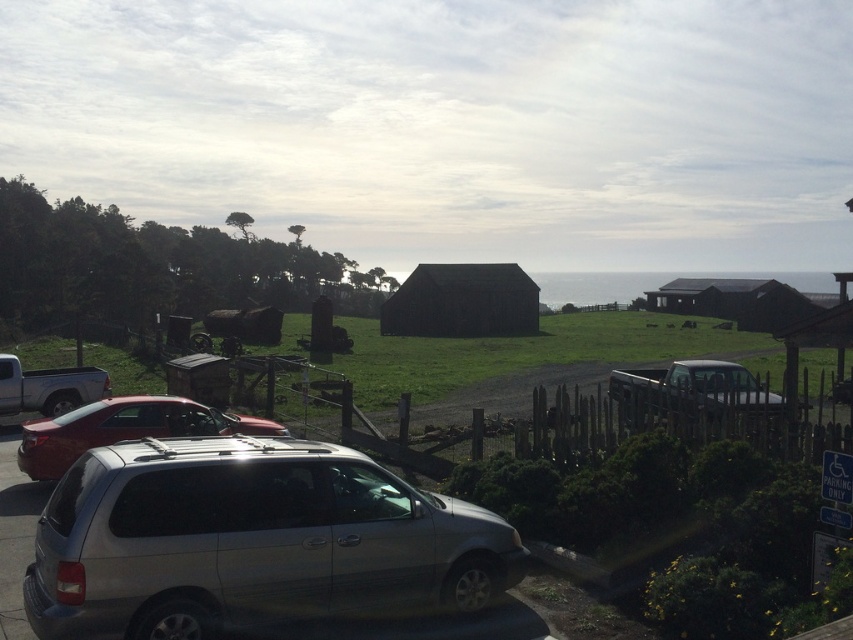
Does metallic silver truck at right appear on the left side of dark brown wooden hut at right?

Indeed, metallic silver truck at right is positioned on the left side of dark brown wooden hut at right.

Which is behind, point (732, 387) or point (729, 285)?

Point (729, 285)

This screenshot has height=640, width=853. I want to click on metallic silver truck at right, so click(691, 388).

Identify the location of metallic silver truck at right. (691, 388).

Can you confirm if satin silver minivan at center is smaller than metallic silver truck at right?

Yes.

Does satin silver minivan at center appear over metallic silver truck at right?

No, satin silver minivan at center is not above metallic silver truck at right.

Between point (227, 532) and point (693, 408), which one is positioned behind?

The point (693, 408) is behind.

This screenshot has width=853, height=640. I want to click on satin silver minivan at center, so click(252, 541).

Based on the photo, does dark brown wooden hut at right appear on the left side of silver metallic suv at lower left?

No, dark brown wooden hut at right is not to the left of silver metallic suv at lower left.

Measure the distance between dark brown wooden hut at right and camera.

dark brown wooden hut at right and camera are 64.67 meters apart from each other.

What do you see at coordinates (735, 301) in the screenshot? The width and height of the screenshot is (853, 640). I see `dark brown wooden hut at right` at bounding box center [735, 301].

The width and height of the screenshot is (853, 640). In order to click on dark brown wooden hut at right in this screenshot , I will do `click(735, 301)`.